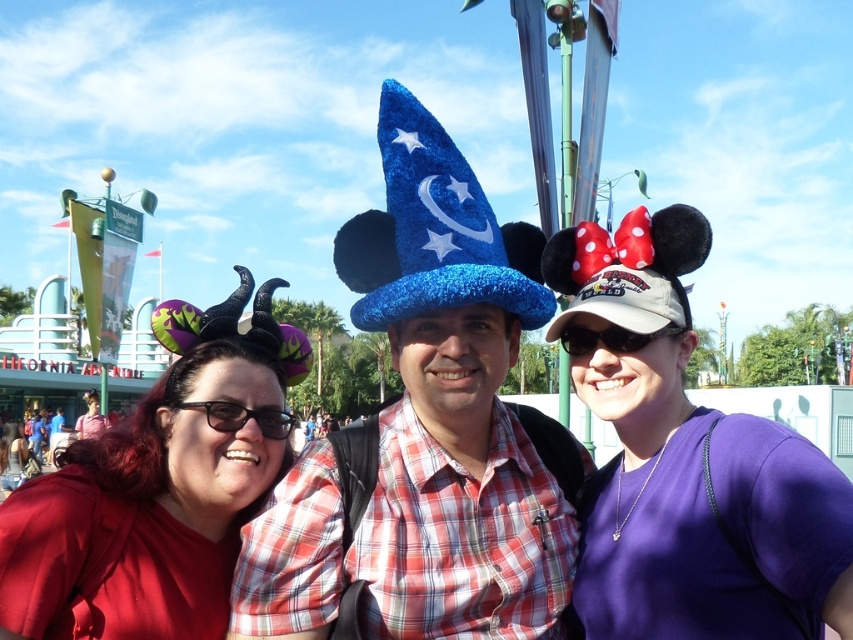
Is point (817, 472) more distant than point (636, 332)?

No, it is not.

Locate an element on the screen. The width and height of the screenshot is (853, 640). purple fabric minnie mouse hat at right is located at coordinates (689, 465).

Is matte red shirt at center to the left of matte red shirt at lower left from the viewer's perspective?

No, matte red shirt at center is not to the left of matte red shirt at lower left.

Which is above, matte red shirt at center or matte red shirt at lower left?

matte red shirt at center is above.

Does point (90, 477) lie in front of point (4, 456)?

Yes, it is.

The height and width of the screenshot is (640, 853). Identify the location of matte red shirt at center. (149, 506).

Between purple fabric minnie mouse hat at right and black plastic goggles at center, which one has more height?

purple fabric minnie mouse hat at right

In the scene shown: Does purple fabric minnie mouse hat at right appear over black plastic goggles at center?

No, purple fabric minnie mouse hat at right is not above black plastic goggles at center.

Where is `purple fabric minnie mouse hat at right`? The height and width of the screenshot is (640, 853). purple fabric minnie mouse hat at right is located at coordinates (689, 465).

Identify the location of purple fabric minnie mouse hat at right. The image size is (853, 640). (689, 465).